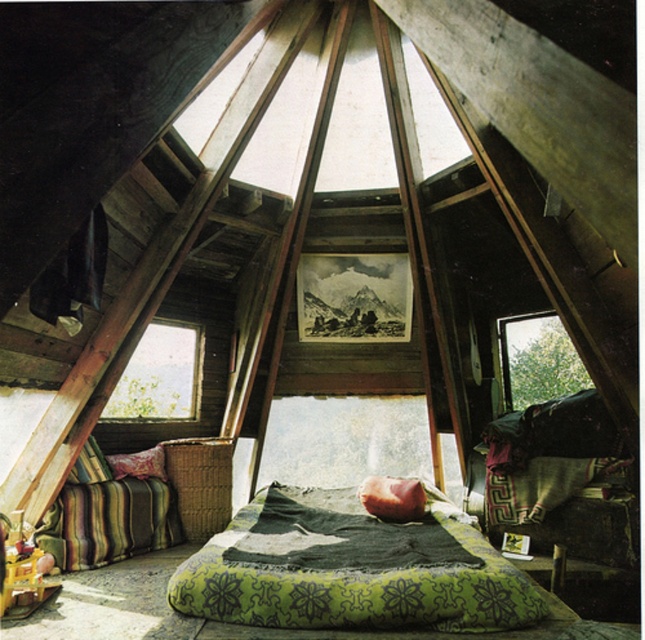
Question: Does transparent glass window at upper right appear on the left side of soft pink fabric pillow at center?

Choices:
 (A) yes
 (B) no

Answer: (B)

Question: Among these objects, which one is nearest to the camera?

Choices:
 (A) velvet green pillow at lower left
 (B) striped fabric pillow at lower left

Answer: (B)

Question: Based on their relative distances, which object is nearer to the soft pink fabric pillow at center?

Choices:
 (A) transparent glass window at lower left
 (B) velvet green pillow at lower left
 (C) green textured fabric bed at center
 (D) transparent glass window at upper right

Answer: (C)

Question: Is transparent glass window at lower left to the right of velvet green pillow at lower left from the viewer's perspective?

Choices:
 (A) no
 (B) yes

Answer: (B)

Question: Is green textured fabric bed at center bigger than transparent glass window at upper right?

Choices:
 (A) no
 (B) yes

Answer: (B)

Question: Which point is closer to the camera?

Choices:
 (A) (186, 372)
 (B) (328, 515)

Answer: (B)